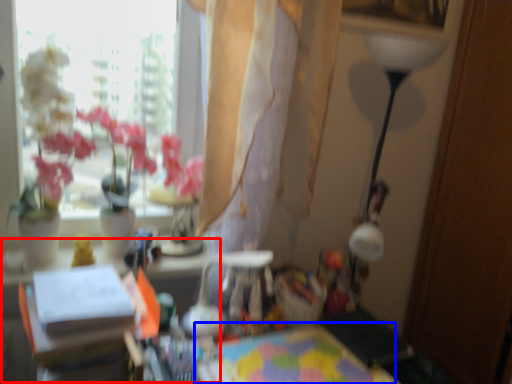
Question: Which object appears closest to the camera in this image, table (highlighted by a red box) or table (highlighted by a blue box)?

Choices:
 (A) table
 (B) table

Answer: (A)